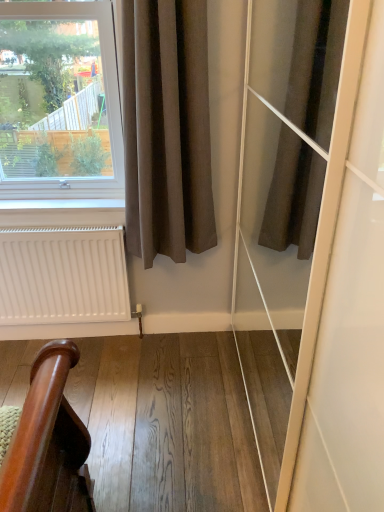
The width and height of the screenshot is (384, 512). Find the location of `free location above wooden handrail at lower left (from a real-world perspective)`. free location above wooden handrail at lower left (from a real-world perspective) is located at coordinates (165, 392).